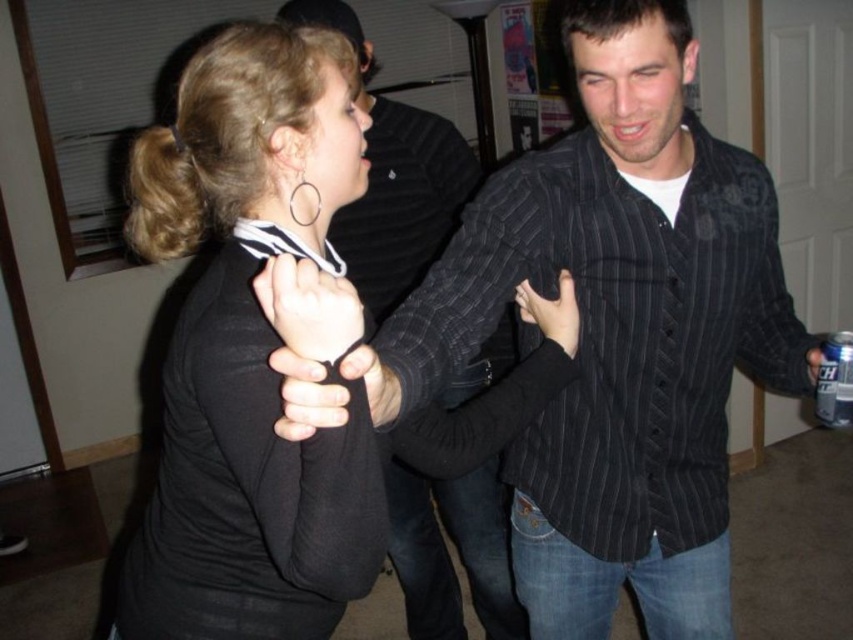
Question: Is black matte glove at center to the left of black matte hand at center from the viewer's perspective?

Choices:
 (A) no
 (B) yes

Answer: (B)

Question: Does black pinstripe shirt at center appear on the right side of matte black glove at center?

Choices:
 (A) yes
 (B) no

Answer: (B)

Question: Does black matte shirt at upper left have a smaller size compared to matte black glove at center?

Choices:
 (A) yes
 (B) no

Answer: (B)

Question: Which of these objects is positioned farthest from the black matte glove at center?

Choices:
 (A) black matte hand at center
 (B) matte black glove at center
 (C) black pinstripe shirt at center
 (D) black matte shirt at upper left

Answer: (C)

Question: Which of the following is the closest to the observer?

Choices:
 (A) (280, 282)
 (B) (358, 385)

Answer: (A)

Question: Which object is farther from the camera taking this photo?

Choices:
 (A) black matte hand at center
 (B) matte black glove at center
 (C) black matte shirt at upper left
 (D) black matte glove at center

Answer: (A)